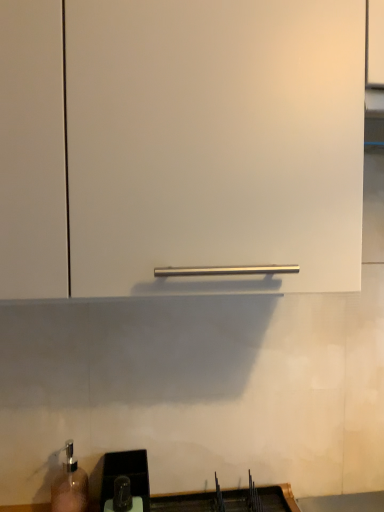
What do you see at coordinates (189, 492) in the screenshot? I see `black plastic sink at lower center` at bounding box center [189, 492].

What are the coordinates of `black plastic sink at lower center` in the screenshot? It's located at (189, 492).

Where is `white matte cabinet handle at center`? white matte cabinet handle at center is located at coordinates (215, 145).

The image size is (384, 512). Describe the element at coordinates (215, 145) in the screenshot. I see `white matte cabinet handle at center` at that location.

You are a GUI agent. You are given a task and a screenshot of the screen. Output one action in this format:
    pyautogui.click(x=<x>, y=<y>)
    Task: Click on the black plastic sink at lower center
    
    Given the screenshot: What is the action you would take?
    pyautogui.click(x=189, y=492)

Considering the positions of objects black plastic sink at lower center and white matte cabinet handle at center in the image provided, who is more to the right, black plastic sink at lower center or white matte cabinet handle at center?

From the viewer's perspective, white matte cabinet handle at center appears more on the right side.

Which object is closer to the camera taking this photo, black plastic sink at lower center or white matte cabinet handle at center?

white matte cabinet handle at center is in front.

Is point (103, 508) closer or farther from the camera than point (73, 236)?

Point (103, 508) is positioned farther from the camera compared to point (73, 236).

Consider the image. From the image's perspective, between black plastic sink at lower center and white matte cabinet handle at center, which one is located above?

white matte cabinet handle at center.

From a real-world perspective, is black plastic sink at lower center positioned under white matte cabinet handle at center based on gravity?

Correct, in the physical world, black plastic sink at lower center is lower than white matte cabinet handle at center.

Does black plastic sink at lower center have a greater width compared to white matte cabinet handle at center?

No.

From their relative heights in the image, would you say black plastic sink at lower center is taller or shorter than white matte cabinet handle at center?

Clearly, black plastic sink at lower center is shorter compared to white matte cabinet handle at center.

In terms of size, does black plastic sink at lower center appear bigger or smaller than white matte cabinet handle at center?

black plastic sink at lower center is smaller than white matte cabinet handle at center.

Is white matte cabinet handle at center surrounded by black plastic sink at lower center?

No, white matte cabinet handle at center is located outside of black plastic sink at lower center.

Does black plastic sink at lower center touch white matte cabinet handle at center?

black plastic sink at lower center and white matte cabinet handle at center are clearly separated.

Looking at this image, is black plastic sink at lower center facing away from white matte cabinet handle at center?

No, black plastic sink at lower center is not facing the opposite direction of white matte cabinet handle at center.

Can you tell me how much black plastic sink at lower center and white matte cabinet handle at center differ in facing direction?

The angle between the facing direction of black plastic sink at lower center and the facing direction of white matte cabinet handle at center is 1.14 degrees.

How distant is black plastic sink at lower center from white matte cabinet handle at center?

They are 27.27 inches apart.

The image size is (384, 512). I want to click on cabinetry that is in front of the black plastic sink at lower center, so click(215, 145).

Considering the relative positions of white matte cabinet handle at center and black plastic sink at lower center in the image provided, is white matte cabinet handle at center to the left of black plastic sink at lower center from the viewer's perspective?

In fact, white matte cabinet handle at center is to the right of black plastic sink at lower center.

Is the depth of white matte cabinet handle at center less than that of black plastic sink at lower center?

Yes, white matte cabinet handle at center is in front of black plastic sink at lower center.

Is point (345, 2) closer or farther from the camera than point (226, 492)?

Point (345, 2) appears to be closer to the viewer than point (226, 492).

From the image's perspective, does white matte cabinet handle at center appear lower than black plastic sink at lower center?

No.

From a real-world perspective, between white matte cabinet handle at center and black plastic sink at lower center, who is vertically higher?

In real-world perspective, white matte cabinet handle at center is above.

Considering the relative sizes of white matte cabinet handle at center and black plastic sink at lower center in the image provided, is white matte cabinet handle at center wider than black plastic sink at lower center?

Yes, white matte cabinet handle at center is wider than black plastic sink at lower center.

Considering the sizes of objects white matte cabinet handle at center and black plastic sink at lower center in the image provided, who is taller, white matte cabinet handle at center or black plastic sink at lower center?

white matte cabinet handle at center is taller.

Which of these two, white matte cabinet handle at center or black plastic sink at lower center, is smaller?

With smaller size is black plastic sink at lower center.

Is black plastic sink at lower center completely or partially inside white matte cabinet handle at center?

Definitely not — black plastic sink at lower center is not inside white matte cabinet handle at center.

Is white matte cabinet handle at center touching black plastic sink at lower center?

white matte cabinet handle at center and black plastic sink at lower center are clearly separated.

Is white matte cabinet handle at center positioned with its back to black plastic sink at lower center?

No, white matte cabinet handle at center is not facing away from black plastic sink at lower center.

How different are the orientations of white matte cabinet handle at center and black plastic sink at lower center in degrees?

The angle between the facing direction of white matte cabinet handle at center and the facing direction of black plastic sink at lower center is 1.14 degrees.

Identify the location of sink that is below the white matte cabinet handle at center (from the image's perspective). (189, 492).

I want to click on sink beneath the white matte cabinet handle at center (from a real-world perspective), so click(x=189, y=492).

The image size is (384, 512). I want to click on sink behind the white matte cabinet handle at center, so click(189, 492).